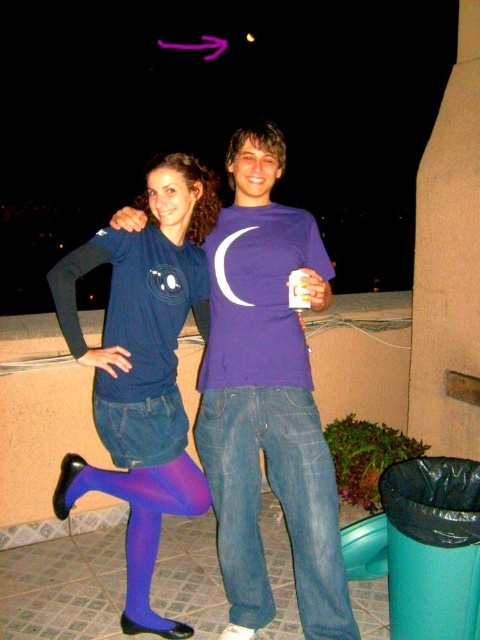
Does point (191, 499) come closer to viewer compared to point (276, 397)?

No, it is not.

Is purple tights at center behind jeans at center?

No.

Where is `purple tights at center`? This screenshot has height=640, width=480. purple tights at center is located at coordinates (142, 369).

The height and width of the screenshot is (640, 480). Identify the location of purple matte t-shirt at center. (267, 400).

Does purple matte t-shirt at center have a smaller size compared to jeans at center?

Actually, purple matte t-shirt at center might be larger than jeans at center.

Which is behind, point (283, 426) or point (317, 632)?

Positioned behind is point (283, 426).

Find the location of a particular element. The width and height of the screenshot is (480, 640). purple matte t-shirt at center is located at coordinates (267, 400).

Which is in front, point (261, 576) or point (177, 266)?

Positioned in front is point (177, 266).

Who is more distant from viewer, (233, 476) or (132, 285)?

Positioned behind is point (233, 476).

The height and width of the screenshot is (640, 480). In order to click on purple matte t-shirt at center in this screenshot , I will do `click(267, 400)`.